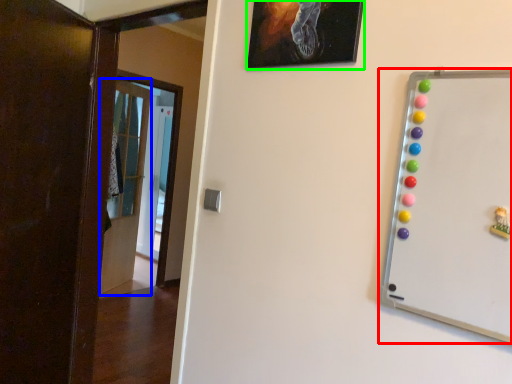
Question: Based on their relative distances, which object is nearer to whiteboard (highlighted by a red box)? Choose from door (highlighted by a blue box) and picture frame (highlighted by a green box).

Choices:
 (A) door
 (B) picture frame

Answer: (B)